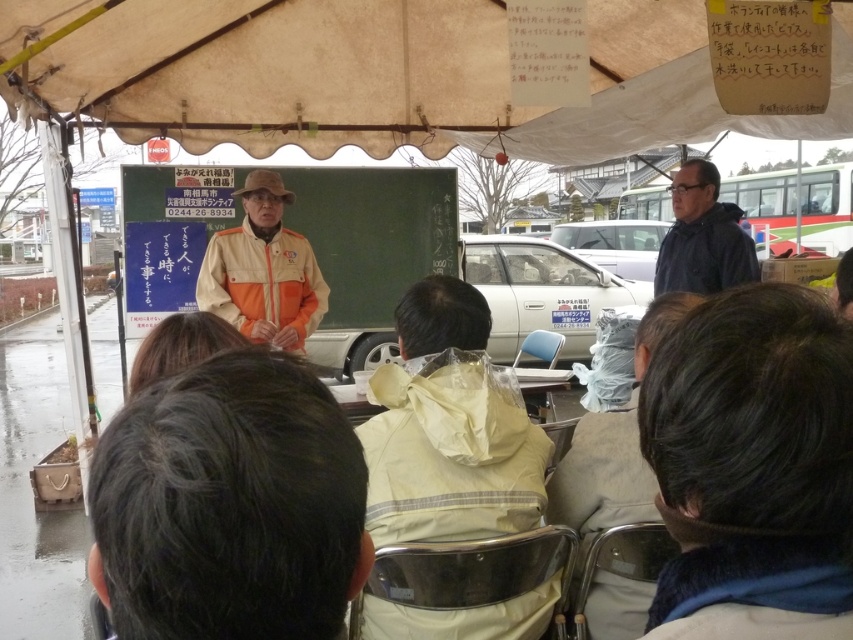
You are a photographer standing at the camera position. You want to capture a closeup of the dark brown hair at lower right without moving the camera. Is it possible to do so with a standard zoom lens that has a minimum focusing distance of 24 inches?

The dark brown hair at lower right is 23.09 inches away from the camera, which is closer than the minimum focusing distance of 24 inches. Therefore, it is not possible to capture a closeup of the dark brown hair at lower right without moving the camera because the lens cannot focus that close.